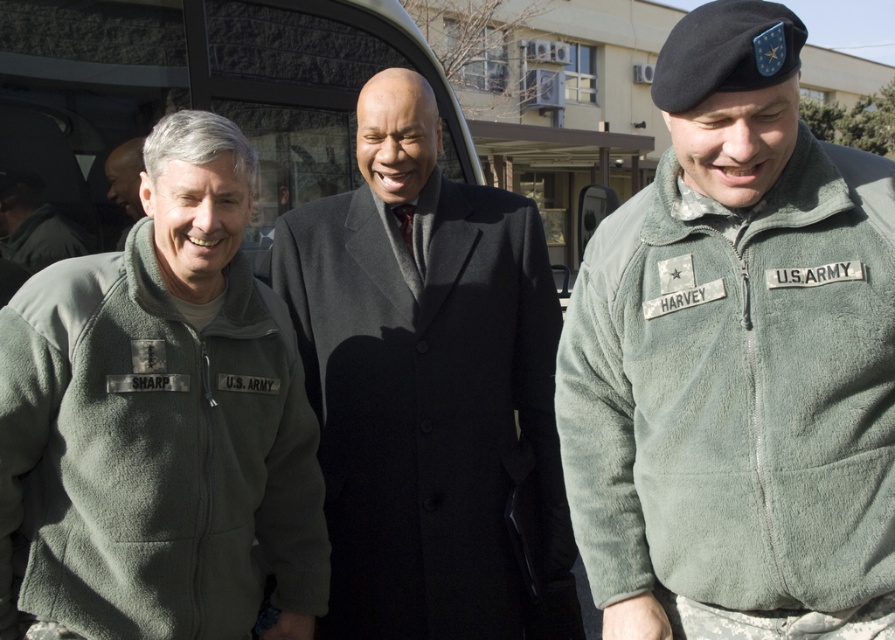
Which of these two, sage fleece jacket at right or matte black jacket at left, stands shorter?

Standing shorter between the two is matte black jacket at left.

Where is `sage fleece jacket at right`? This screenshot has height=640, width=895. sage fleece jacket at right is located at coordinates (736, 392).

Which of these two, sage fleece jacket at right or metallic gray van at center, stands taller?

metallic gray van at center

Is sage fleece jacket at right above metallic gray van at center?

No.

Describe the element at coordinates (736, 392) in the screenshot. This screenshot has width=895, height=640. I see `sage fleece jacket at right` at that location.

At what (x,y) coordinates should I click in order to perform the action: click on sage fleece jacket at right. Please return your answer as a coordinate pair (x, y). The image size is (895, 640). Looking at the image, I should click on (736, 392).

Can you confirm if matte green fleece jacket at left is shorter than matte black coat at center?

In fact, matte green fleece jacket at left may be taller than matte black coat at center.

Between matte green fleece jacket at left and matte black coat at center, which one appears on the left side from the viewer's perspective?

From the viewer's perspective, matte black coat at center appears more on the left side.

Is point (202, 358) closer to camera compared to point (122, 177)?

Yes, it is in front of point (122, 177).

Locate an element on the screen. Image resolution: width=895 pixels, height=640 pixels. matte green fleece jacket at left is located at coordinates (152, 454).